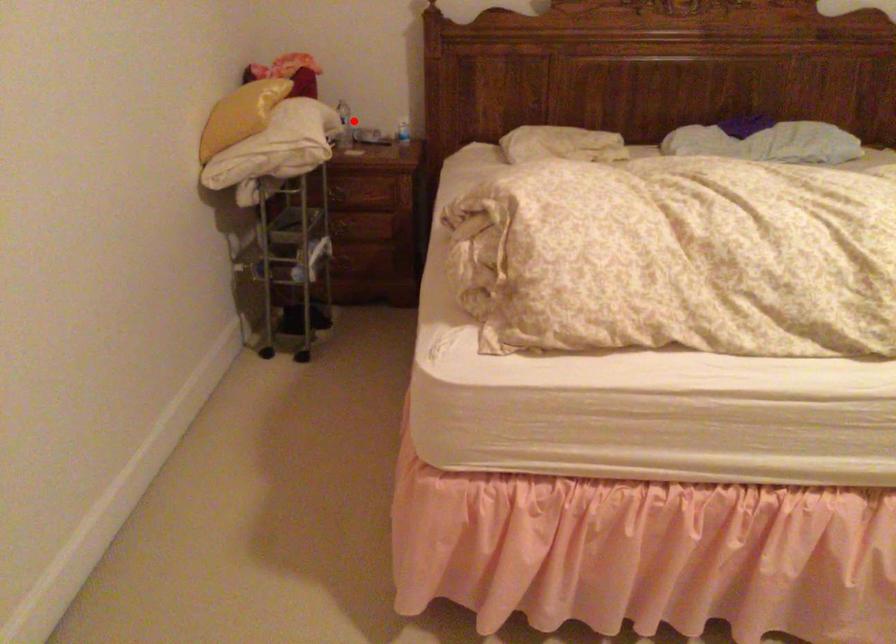
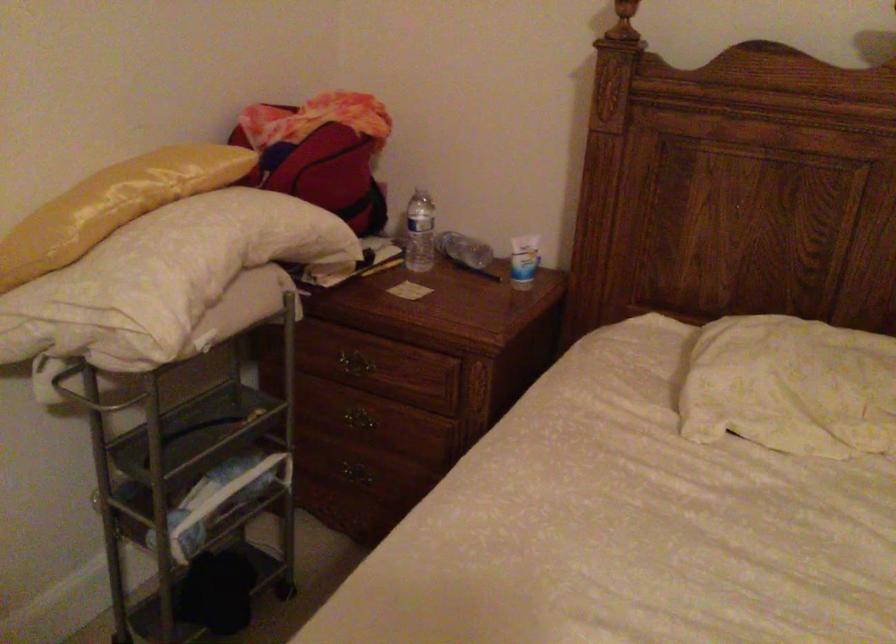
Question: I am providing you with two images of the same scene from different viewpoints. Given a red point in image1, look at the same physical point in image2. Is it:

Choices:
 (A) Closer to the viewpoint
 (B) Farther from the viewpoint

Answer: (A)